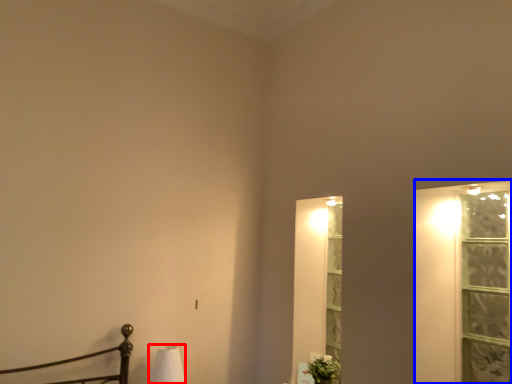
Question: Among these objects, which one is farthest to the camera, table lamp (highlighted by a red box) or window frame (highlighted by a blue box)?

Choices:
 (A) table lamp
 (B) window frame

Answer: (A)